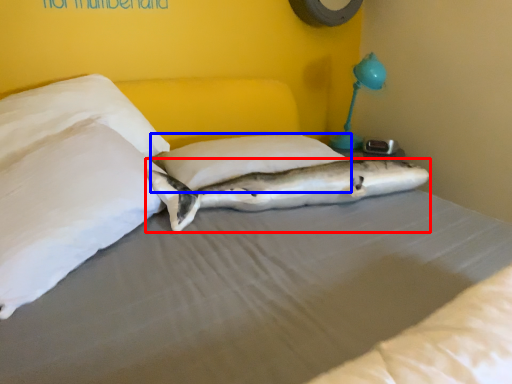
Question: Among these objects, which one is nearest to the camera, shark (highlighted by a red box) or pillow (highlighted by a blue box)?

Choices:
 (A) shark
 (B) pillow

Answer: (A)